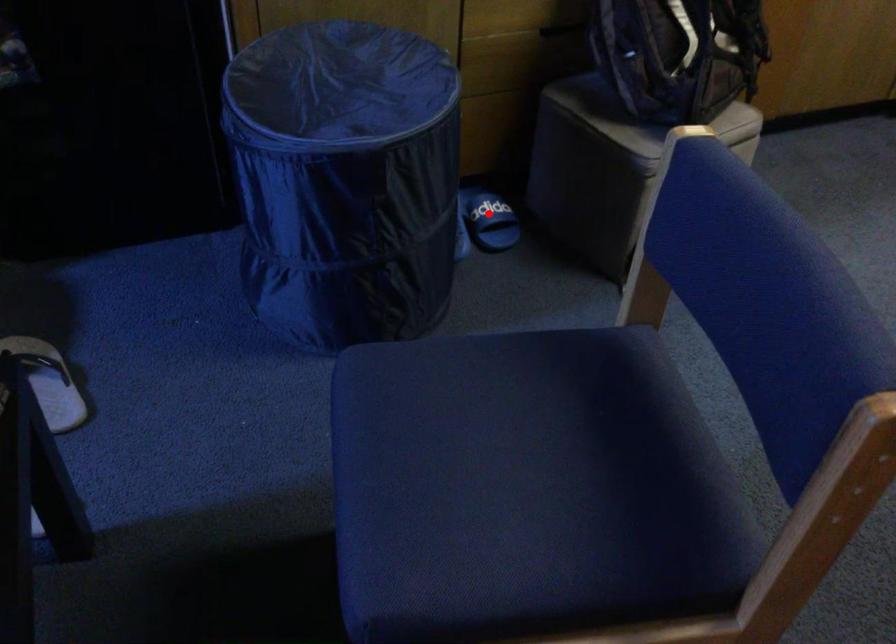
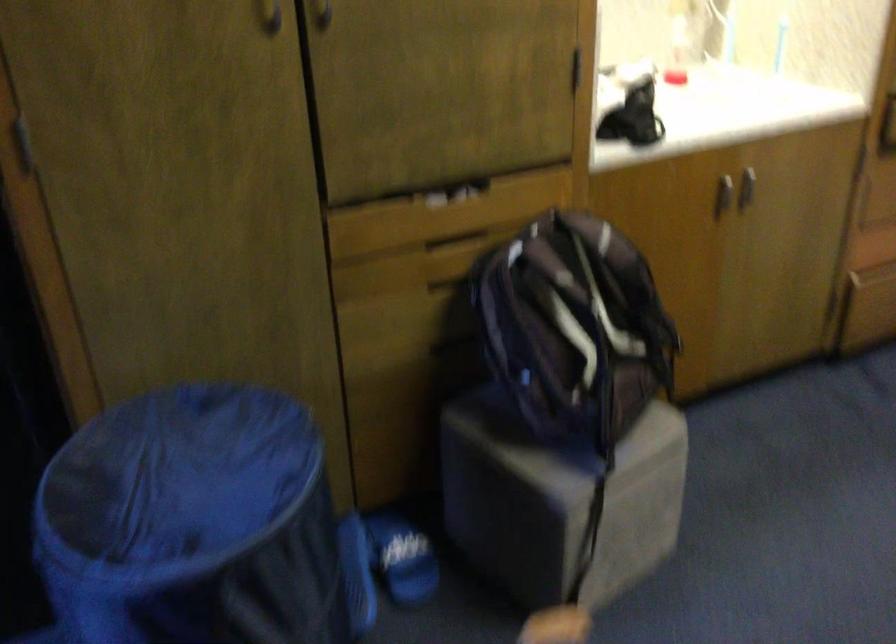
Question: I am providing you with two images of the same scene from different viewpoints. Image1 has a red point marked. In image2, the corresponding 3D location appears at what relative position? Reply with the corresponding letter.

Choices:
 (A) Closer
 (B) Farther

Answer: (A)